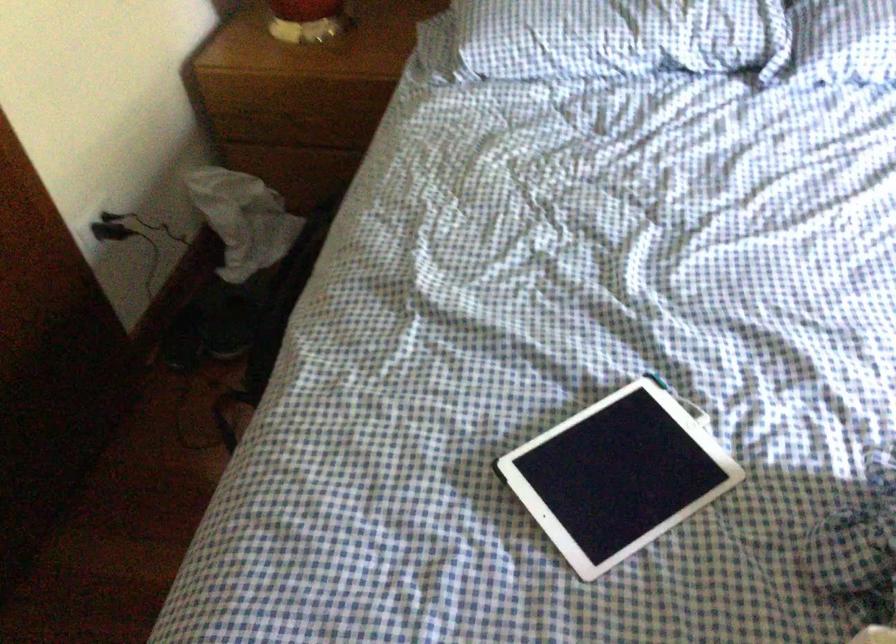
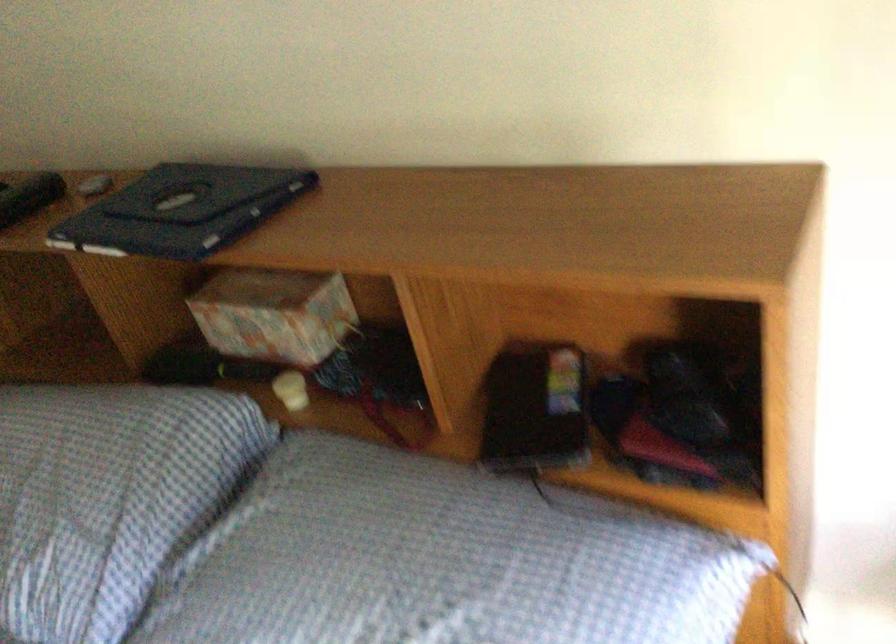
In a continuous first-person perspective shot, in which direction is the camera moving?

The cameraman moved toward right, forward.